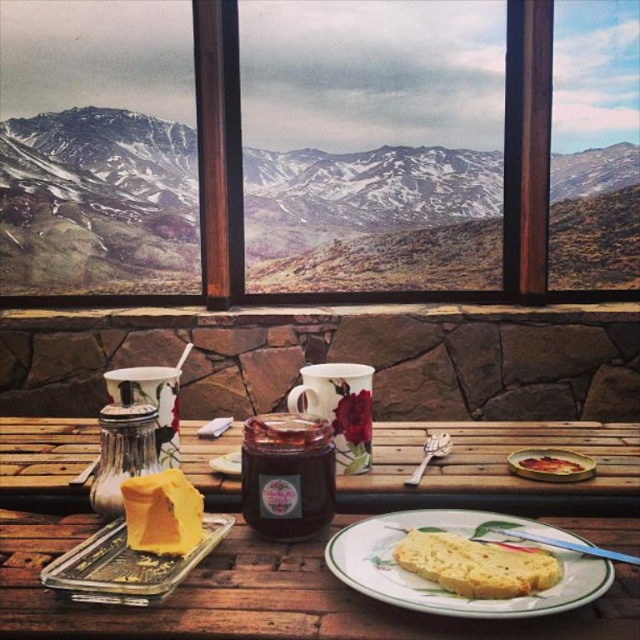
Question: Can you confirm if translucent glass jar at lower left is wider than dark brown glass jar at center?

Choices:
 (A) no
 (B) yes

Answer: (B)

Question: Which object appears farthest from the camera in this image?

Choices:
 (A) wooden picnic table at center
 (B) yellow cheese at center
 (C) white glossy plate at center
 (D) shiny red jam jar at center

Answer: (D)

Question: Which of these objects is positioned farthest from the silver metallic spoon at center?

Choices:
 (A) transparent glass window at center
 (B) shiny red jam jar at center
 (C) wooden picnic table at center
 (D) yellow cheese at center

Answer: (A)

Question: Which point is farther from the camera taking this photo?

Choices:
 (A) (579, 481)
 (B) (259, 467)
 (C) (429, 456)
 (D) (589, 580)

Answer: (C)

Question: Does dark brown glass jar at center have a smaller size compared to silver metallic spoon at center?

Choices:
 (A) yes
 (B) no

Answer: (B)

Question: Is matte ceramic plate at center wider than shiny red jam jar at center?

Choices:
 (A) no
 (B) yes

Answer: (B)